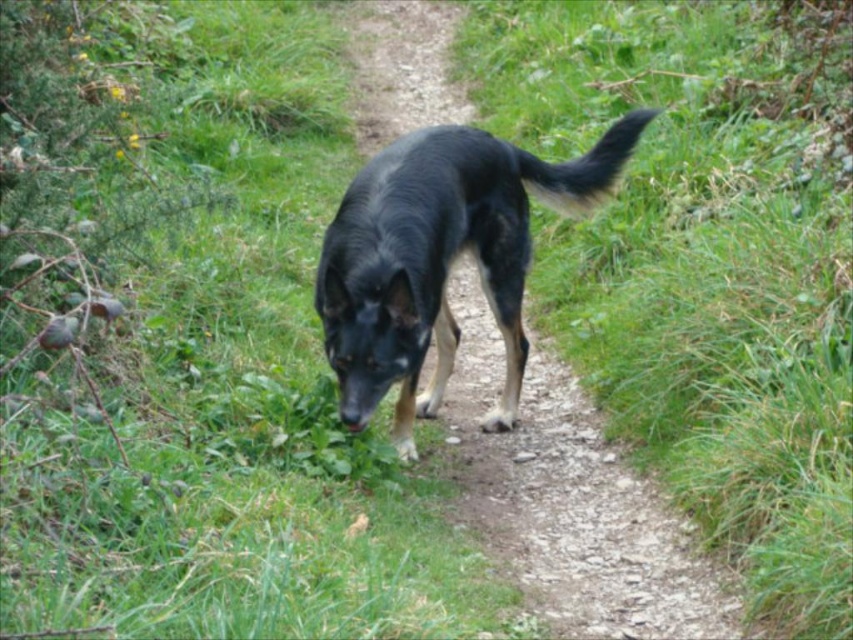
Is green grassy at center taller than shiny black fur at center?

Indeed, green grassy at center has a greater height compared to shiny black fur at center.

Is green grassy at center positioned behind shiny black fur at center?

No, green grassy at center is closer to the viewer.

Locate an element on the screen. green grassy at center is located at coordinates (695, 276).